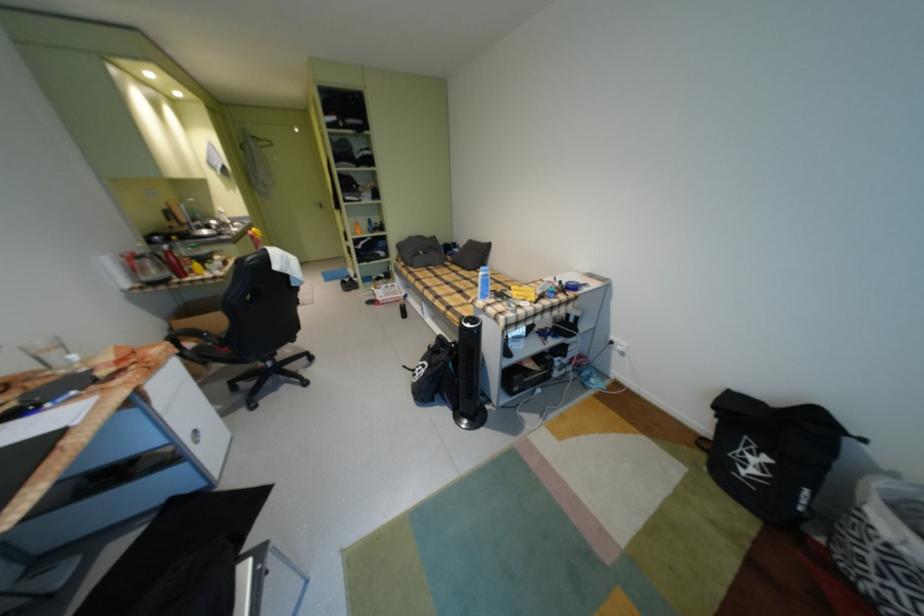
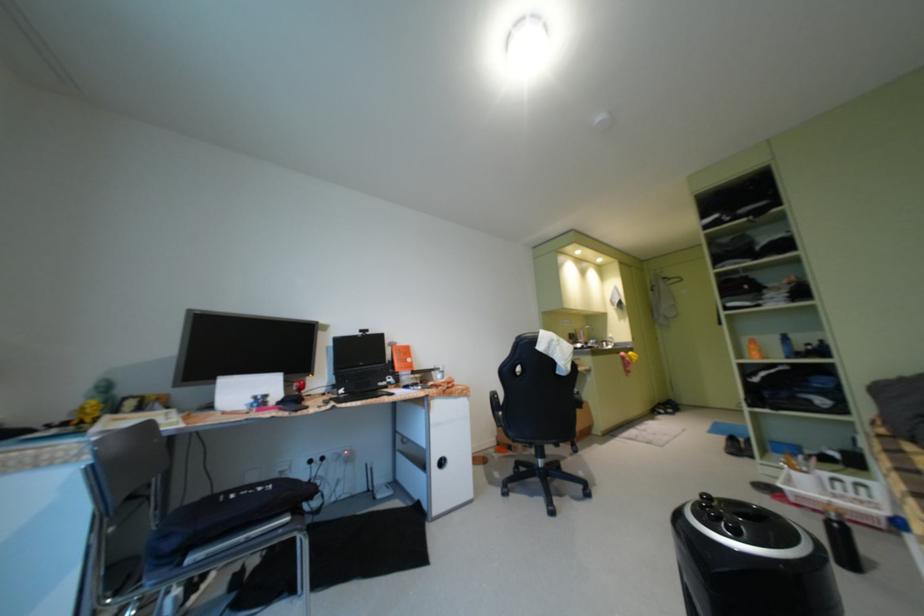
Question: The images are taken continuously from a first-person perspective. In which direction is your viewpoint rotating?

Choices:
 (A) Left
 (B) Right
 (C) Up
 (D) Down

Answer: (A)